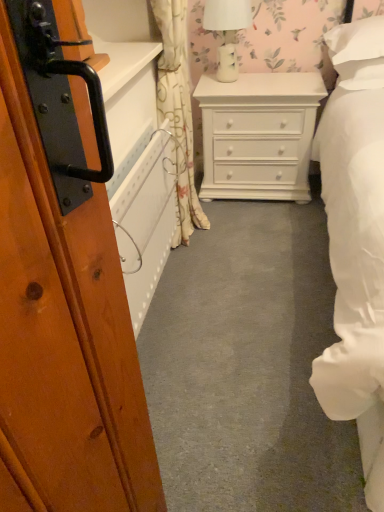
Question: From a real-world perspective, is floral fabric curtain at center over white glossy table lamp at upper center?

Choices:
 (A) yes
 (B) no

Answer: (B)

Question: Is floral fabric curtain at center further to camera compared to white glossy table lamp at upper center?

Choices:
 (A) yes
 (B) no

Answer: (B)

Question: Considering the relative sizes of floral fabric curtain at center and white glossy table lamp at upper center in the image provided, is floral fabric curtain at center taller than white glossy table lamp at upper center?

Choices:
 (A) no
 (B) yes

Answer: (B)

Question: Considering the relative sizes of floral fabric curtain at center and white glossy table lamp at upper center in the image provided, is floral fabric curtain at center shorter than white glossy table lamp at upper center?

Choices:
 (A) no
 (B) yes

Answer: (A)

Question: From the image's perspective, is floral fabric curtain at center on top of white glossy table lamp at upper center?

Choices:
 (A) no
 (B) yes

Answer: (A)

Question: In the image, is floral fabric curtain at center on the left side or the right side of white glossy table lamp at upper center?

Choices:
 (A) right
 (B) left

Answer: (B)

Question: From the image's perspective, is floral fabric curtain at center located above or below white glossy table lamp at upper center?

Choices:
 (A) above
 (B) below

Answer: (B)

Question: Is point (188, 90) closer or farther from the camera than point (226, 37)?

Choices:
 (A) closer
 (B) farther

Answer: (A)

Question: Considering their positions, is floral fabric curtain at center located in front of or behind white glossy table lamp at upper center?

Choices:
 (A) front
 (B) behind

Answer: (A)

Question: Is white glossy table lamp at upper center situated inside floral fabric curtain at center or outside?

Choices:
 (A) outside
 (B) inside

Answer: (A)

Question: Looking at their shapes, would you say white glossy table lamp at upper center is wider or thinner than floral fabric curtain at center?

Choices:
 (A) thin
 (B) wide

Answer: (B)

Question: In terms of height, does white glossy table lamp at upper center look taller or shorter compared to floral fabric curtain at center?

Choices:
 (A) tall
 (B) short

Answer: (B)

Question: Based on their positions, is white glossy table lamp at upper center located to the left or right of floral fabric curtain at center?

Choices:
 (A) right
 (B) left

Answer: (A)

Question: Is white painted wood chest of drawers at center bigger or smaller than floral fabric curtain at center?

Choices:
 (A) small
 (B) big

Answer: (B)

Question: Is white painted wood chest of drawers at center to the left or to the right of floral fabric curtain at center in the image?

Choices:
 (A) left
 (B) right

Answer: (B)